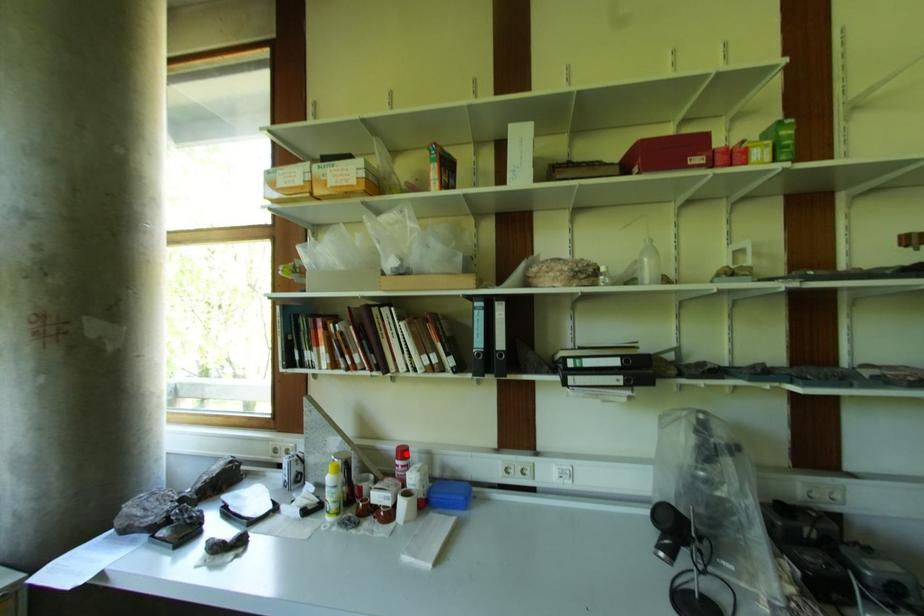
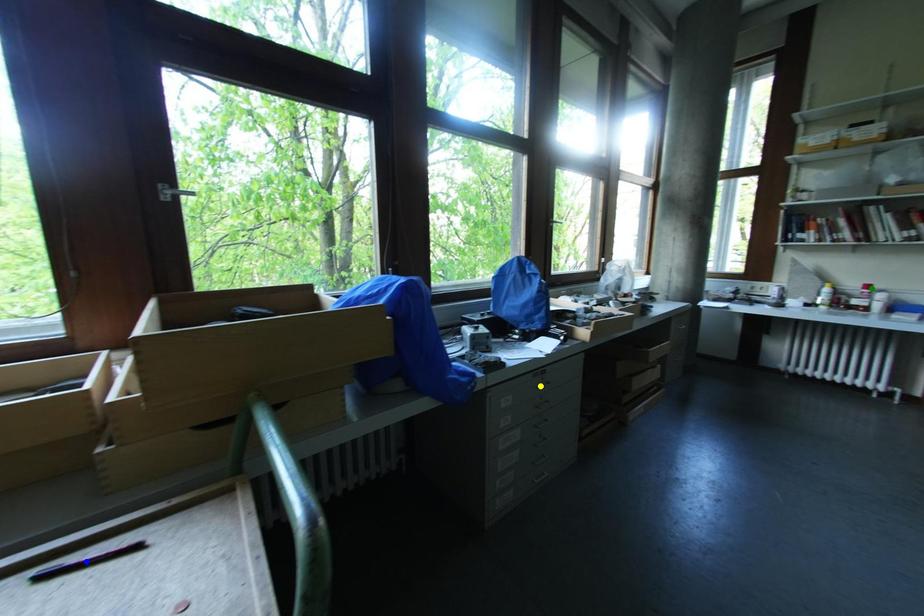
Question: I am providing you with two images of the same scene from different viewpoints. A red point is marked on the first image. You are given multiple points on the second image. Which mark in image 2 goes with the point in image 1?

Choices:
 (A) blue point
 (B) yellow point
 (C) green point

Answer: (C)